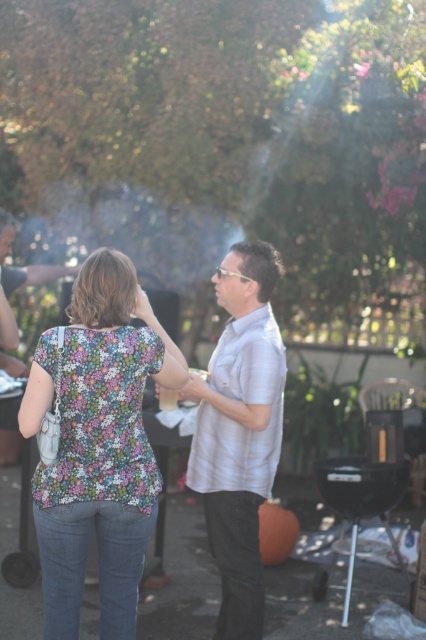
Can you confirm if floral fabric blouse at center is bigger than light gray shirt at center?

Correct, floral fabric blouse at center is larger in size than light gray shirt at center.

Measure the distance between floral fabric blouse at center and light gray shirt at center.

The distance of floral fabric blouse at center from light gray shirt at center is 22.55 inches.

Which is behind, point (138, 364) or point (210, 536)?

The point (210, 536) is behind.

Find the location of `floral fabric blouse at center`. floral fabric blouse at center is located at coordinates (101, 449).